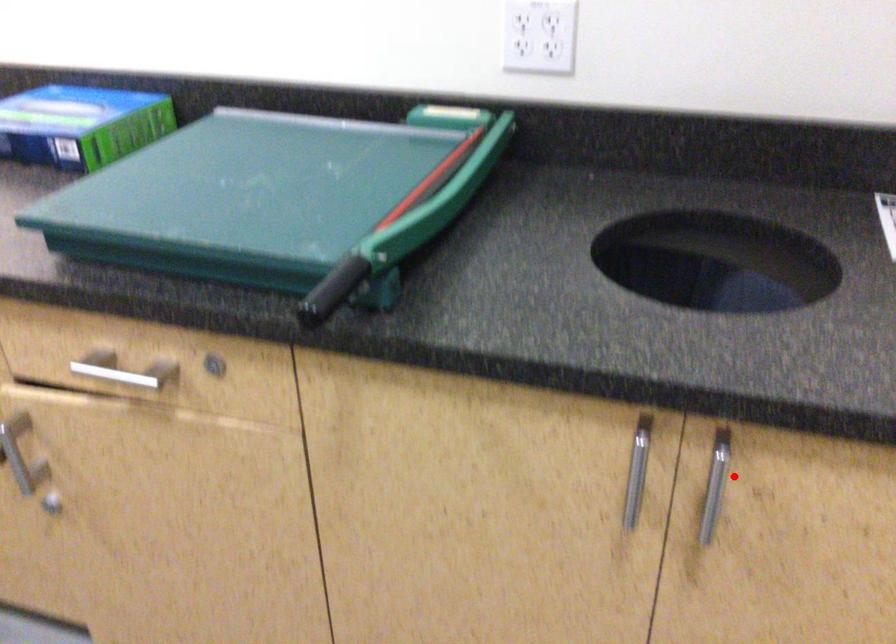
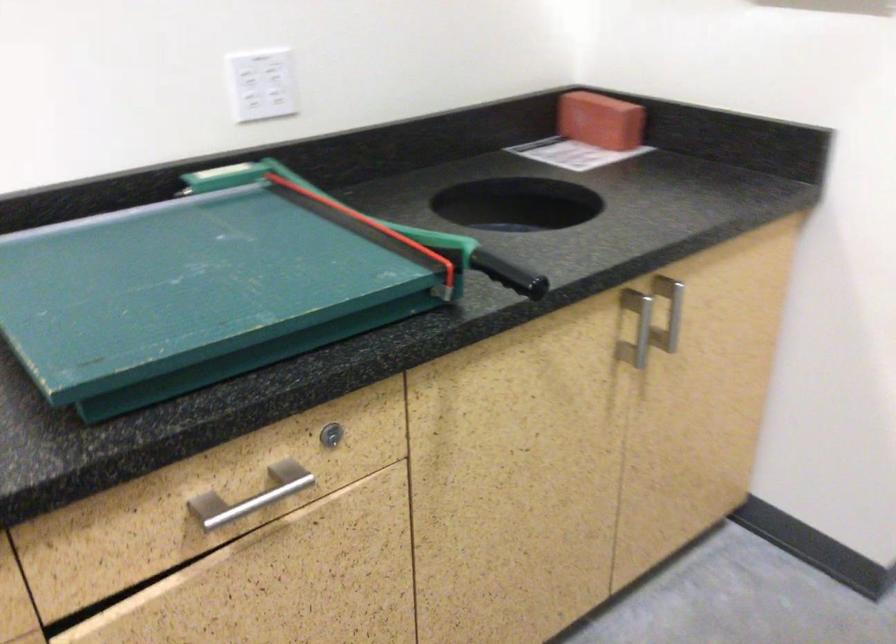
Question: I am providing you with two images of the same scene from different viewpoints. In image1, a red point is highlighted. Considering the same 3D point in image2, which of the following is correct?

Choices:
 (A) It is closer
 (B) It is farther

Answer: (B)